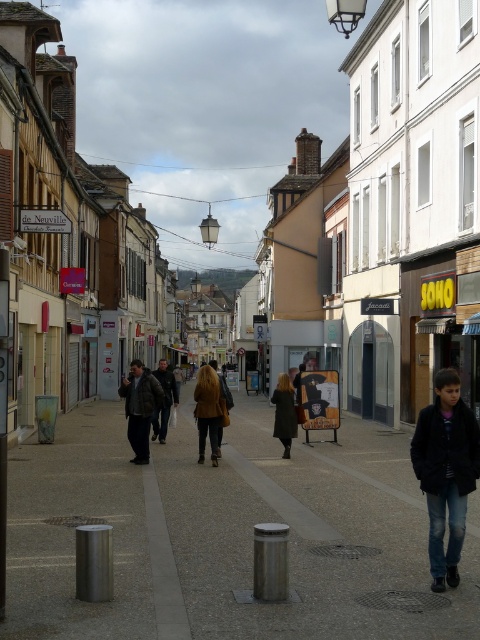
Question: Which object is the farthest from the yellow fabric bag at center?

Choices:
 (A) black matte jacket at lower right
 (B) dark brown leather coat at center
 (C) smooth concrete sidewalk at center
 (D) matte black sign at center

Answer: (D)

Question: Is smooth concrete sidewalk at center wider than black matte jacket at lower right?

Choices:
 (A) no
 (B) yes

Answer: (B)

Question: Where is dark brown leather coat at center located in relation to yellow fabric bag at center in the image?

Choices:
 (A) above
 (B) below

Answer: (B)

Question: Which object is the farthest from the brown leather jacket at center?

Choices:
 (A) leather jacket at center
 (B) smooth concrete sidewalk at center
 (C) yellow fabric bag at center

Answer: (C)

Question: Is yellow fabric bag at center thinner than brown leather jacket at center?

Choices:
 (A) no
 (B) yes

Answer: (A)

Question: Considering the real-world distances, which object is closest to the smooth concrete sidewalk at center?

Choices:
 (A) dark brown leather coat at center
 (B) yellow fabric bag at center

Answer: (A)